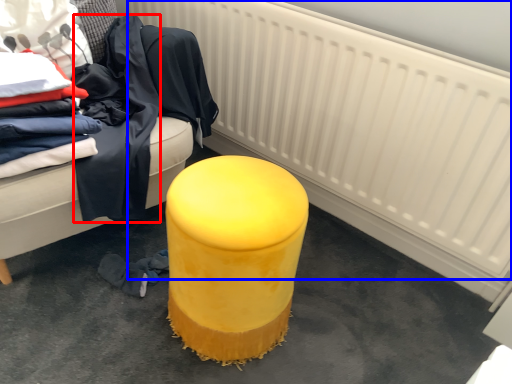
Question: Which point is closer to the camera, clothing (highlighted by a red box) or radiator (highlighted by a blue box)?

Choices:
 (A) clothing
 (B) radiator

Answer: (B)